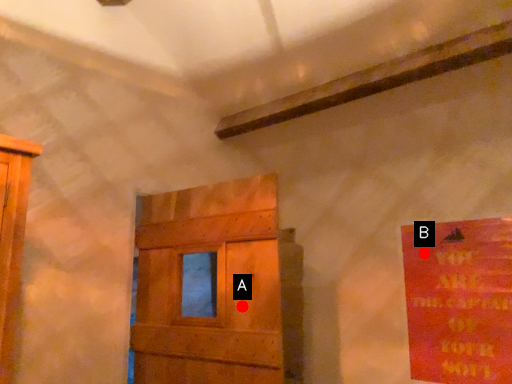
Question: Two points are circled on the image, labeled by A and B beside each circle. Which point is further to the camera?

Choices:
 (A) A is further
 (B) B is further

Answer: (B)